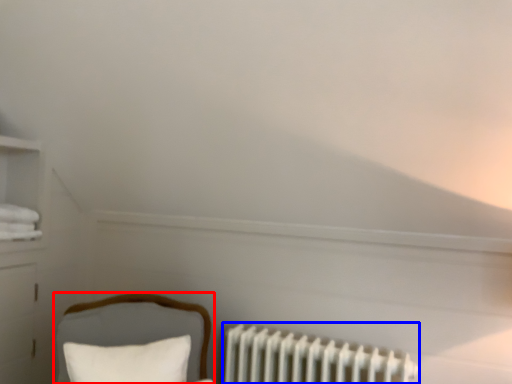
Question: Which object is closer to the camera taking this photo, furniture (highlighted by a red box) or radiator (highlighted by a blue box)?

Choices:
 (A) furniture
 (B) radiator

Answer: (A)